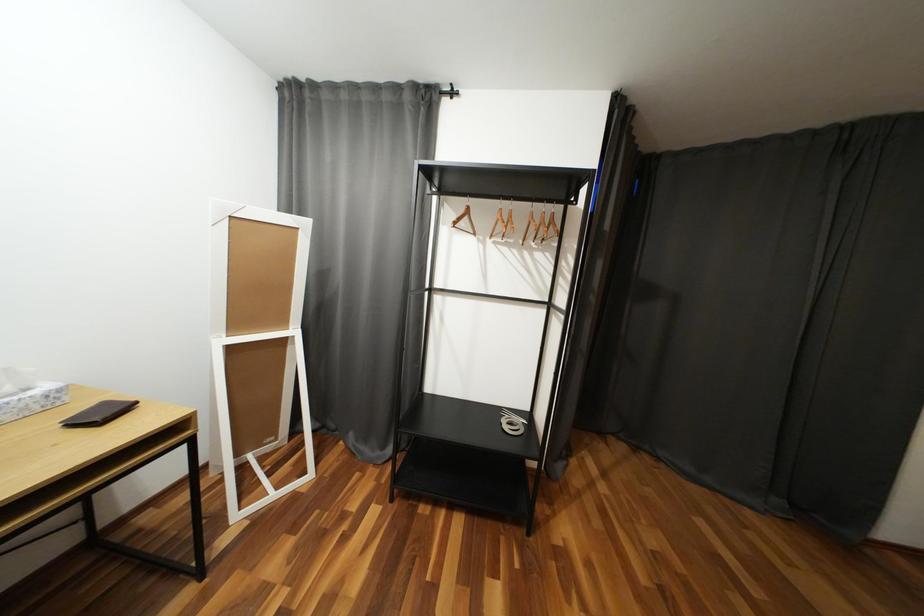
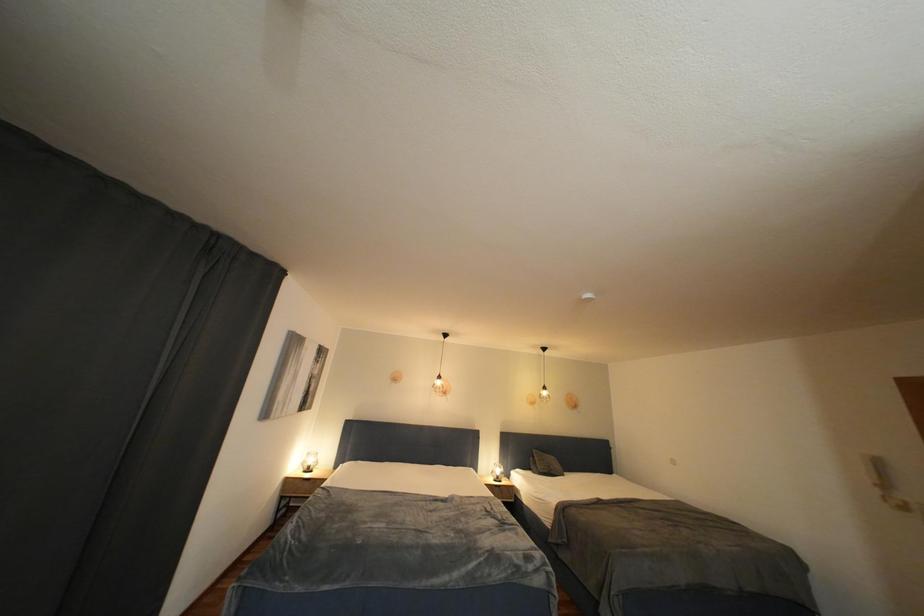
Question: The images are taken continuously from a first-person perspective. In which direction is your viewpoint rotating?

Choices:
 (A) Left
 (B) Right
 (C) Up
 (D) Down

Answer: (B)